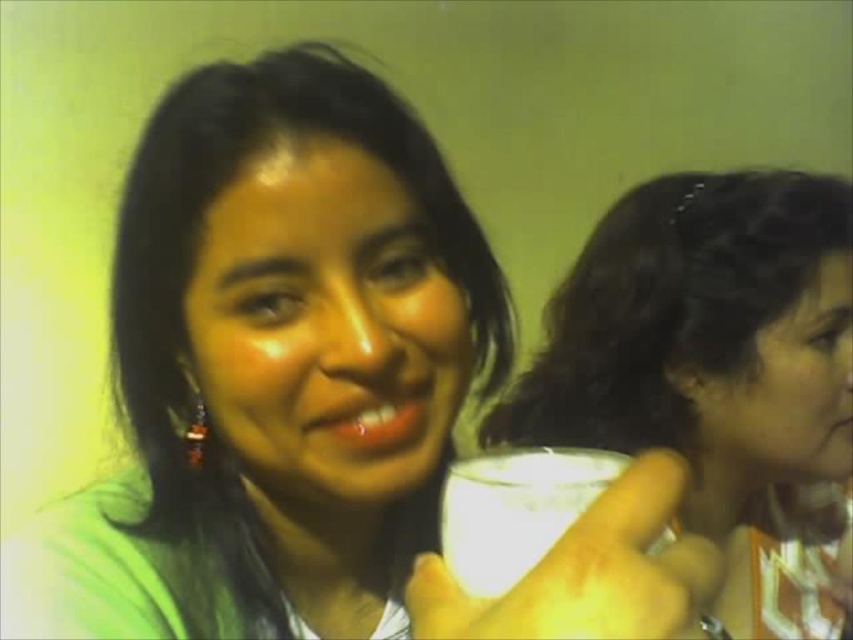
Does matte white cup at right appear under white matte cup at center?

Yes.

Does matte white cup at right have a smaller size compared to white matte cup at center?

No, matte white cup at right is not smaller than white matte cup at center.

Between point (572, 428) and point (633, 557), which one is positioned behind?

The point (572, 428) is more distant.

I want to click on matte white cup at right, so click(x=718, y=376).